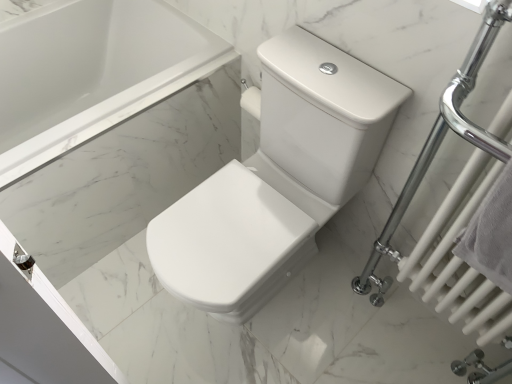
Where is `vacant region to the left of white glossy towel rack at right`? Image resolution: width=512 pixels, height=384 pixels. vacant region to the left of white glossy towel rack at right is located at coordinates (327, 342).